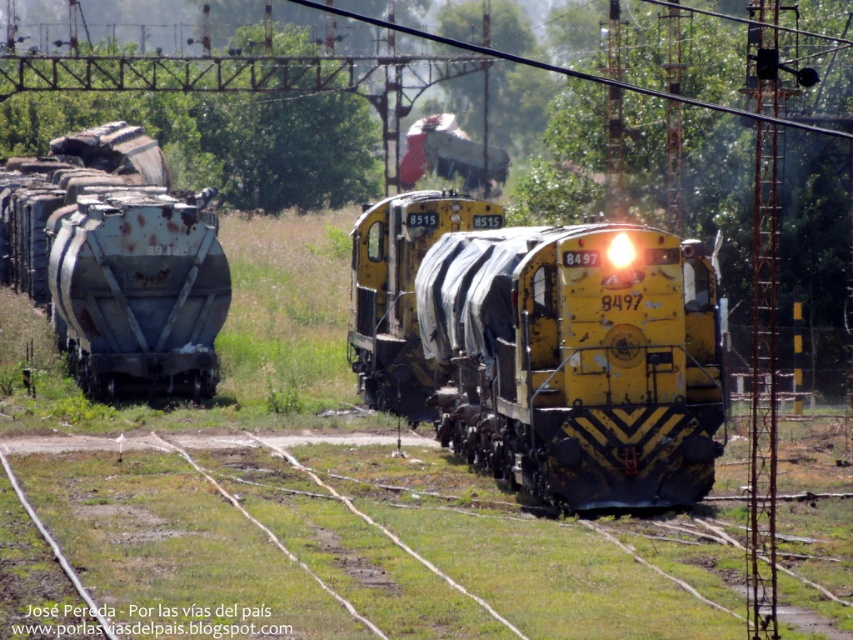
Is point (433, 266) positioned after point (167, 326)?

No, it is in front of (167, 326).

Who is taller, yellow matte train at center or rusty metal tank car at left?

rusty metal tank car at left is taller.

This screenshot has width=853, height=640. I want to click on yellow matte train at center, so click(540, 348).